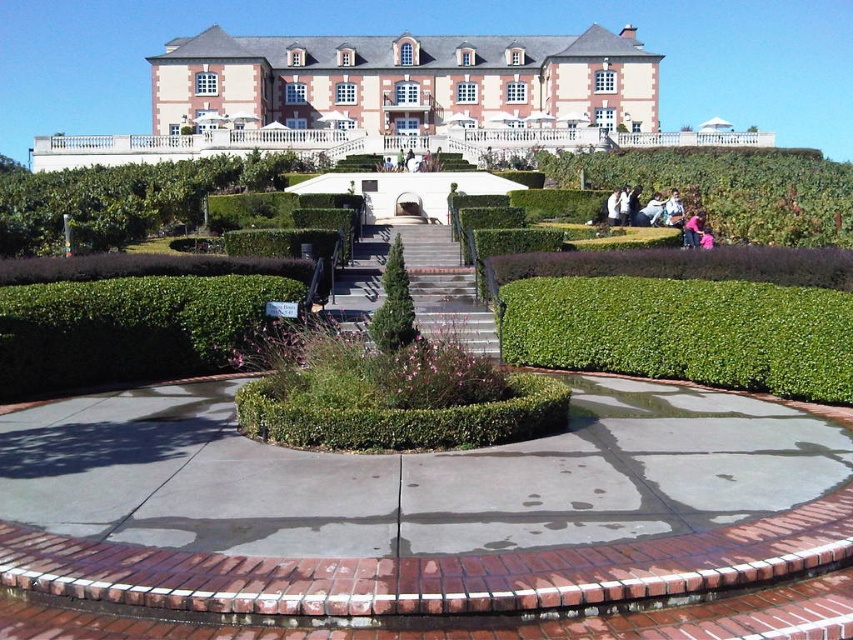
From the picture: You are standing on the circular paved area in front of the building. You see a pink fabric at lower right and a light blue denim jacket at lower right. Which one takes up more space in the scene?

The pink fabric at lower right is larger in size than the light blue denim jacket at lower right, so it takes up more space in the scene.

You are standing at the base of the steps leading to the building and want to walk towards the entrance. There are two points marked in the image, point 1 at coordinates (442, 77) and point 2 at (700, 241). Which point is closer to you as you stand at the bottom of the steps?

Point 1 at coordinates (442, 77) is closer to you because it is further to the viewer than point 2 at (700, 241), meaning it is physically nearer in the scene.